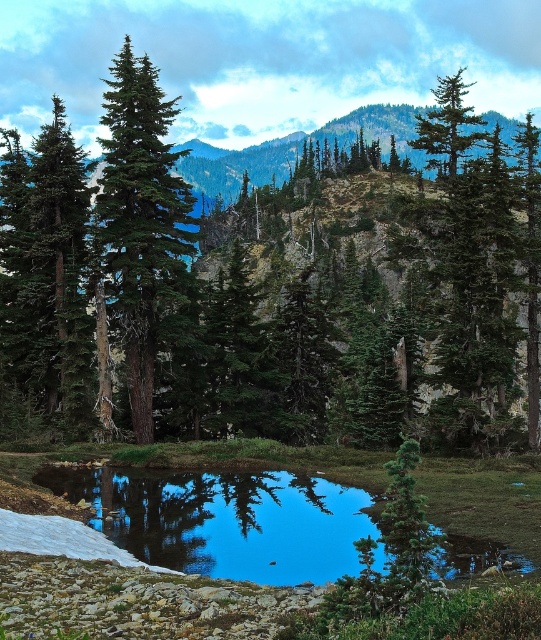
Does green matte tree at left appear on the right side of green matte evergreen tree at upper center?

Incorrect, green matte tree at left is not on the right side of green matte evergreen tree at upper center.

Can you confirm if green matte tree at left is taller than green matte evergreen tree at upper center?

In fact, green matte tree at left may be shorter than green matte evergreen tree at upper center.

Which is behind, point (42, 164) or point (457, 109)?

The point (42, 164) is more distant.

Locate an element on the screen. This screenshot has width=541, height=640. green matte tree at left is located at coordinates (48, 273).

Is clear glass water at center taller than green matte tree at left?

In fact, clear glass water at center may be shorter than green matte tree at left.

Does clear glass water at center have a larger size compared to green matte tree at left?

No.

Is point (169, 509) positioned in front of point (54, 376)?

That is True.

Find the location of a particular element. This screenshot has width=541, height=640. clear glass water at center is located at coordinates (227, 518).

Does point (261, 477) come closer to viewer compared to point (440, 177)?

Yes, point (261, 477) is in front of point (440, 177).

Which is more to the left, clear glass water at center or green matte evergreen tree at upper center?

clear glass water at center is more to the left.

You are a GUI agent. You are given a task and a screenshot of the screen. Output one action in this format:
    pyautogui.click(x=<x>, y=<y>)
    Task: Click on the clear glass water at center
    Image resolution: width=541 pixels, height=640 pixels.
    Given the screenshot: What is the action you would take?
    pyautogui.click(x=227, y=518)